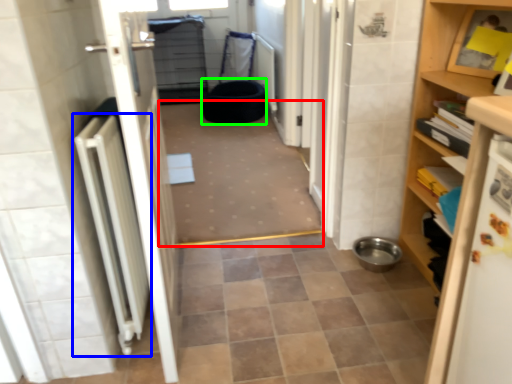
Question: Estimate the real-world distances between objects in this image. Which object is farther from plain (highlighted by a red box), radiator (highlighted by a blue box) or toilet bowl (highlighted by a green box)?

Choices:
 (A) radiator
 (B) toilet bowl

Answer: (A)